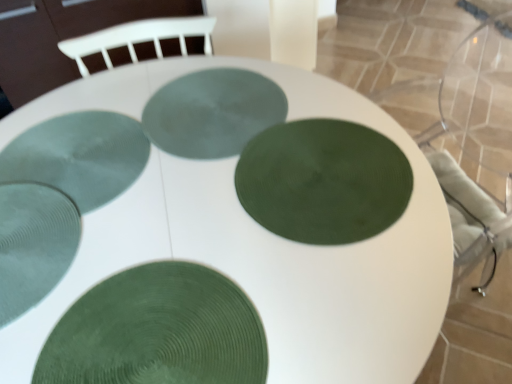
Locate an element on the screen. Image resolution: width=512 pixels, height=384 pixels. vacant area on top of green textured glass plate at center, which appears as the 5th glass plate when viewed from the front (from a real-world perspective) is located at coordinates (211, 108).